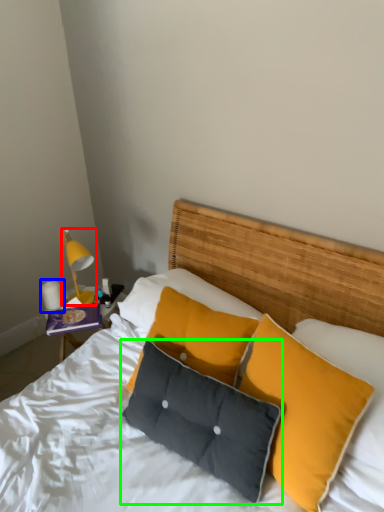
Question: Which object is the closest to the bedside lamp (highlighted by a red box)? Choose among these: lamp (highlighted by a blue box) or pillow (highlighted by a green box).

Choices:
 (A) lamp
 (B) pillow

Answer: (A)